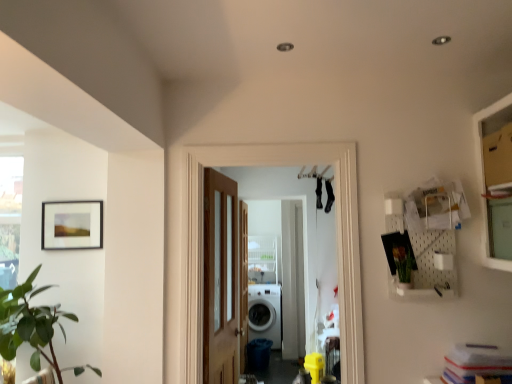
Question: Is point 46,314 closer or farther from the camera than point 243,226?

Choices:
 (A) closer
 (B) farther

Answer: (A)

Question: Visually, is green leafy plant at left positioned to the left or to the right of clear glass screen door at center?

Choices:
 (A) left
 (B) right

Answer: (A)

Question: Which object is the farthest from the clear glass screen door at center?

Choices:
 (A) green matte vase at right
 (B) matte black picture frame at upper left
 (C) white pegboard at upper right
 (D) white glossy washing machine at center
 (E) green leafy plant at left

Answer: (D)

Question: Estimate the real-world distances between objects in this image. Which object is farther from the green leafy plant at left?

Choices:
 (A) green matte vase at right
 (B) white glossy washing machine at center
 (C) white pegboard at upper right
 (D) wooden door at center
 (E) clear glass screen door at center

Answer: (B)